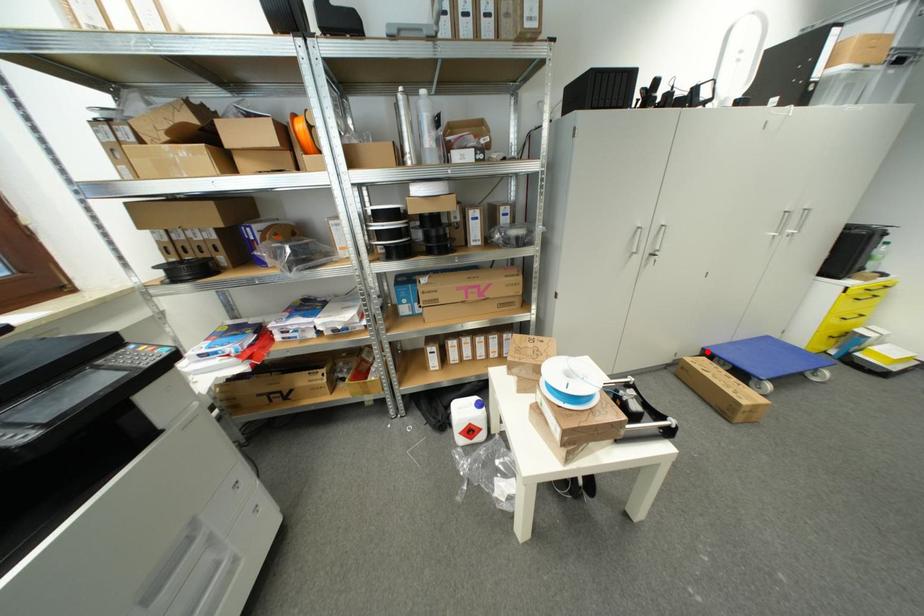
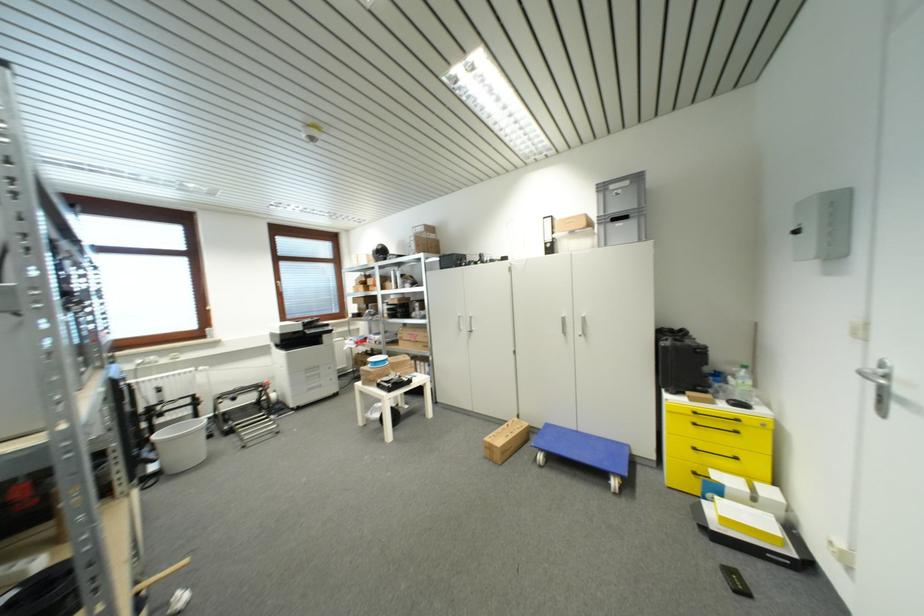
Question: I am providing you with two images of the same scene from different viewpoints. A red point is shown in image1. For the corresponding object point in image2, is it positioned nearer or farther from the camera?

Choices:
 (A) Nearer
 (B) Farther

Answer: (A)